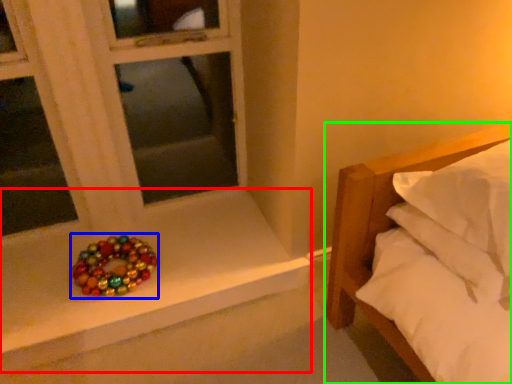
Question: Which is nearer to the window sill (highlighted by a red box)? glass bead (highlighted by a blue box) or bed (highlighted by a green box).

Choices:
 (A) glass bead
 (B) bed

Answer: (A)